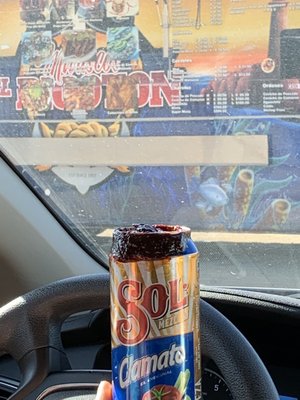
This screenshot has width=300, height=400. I want to click on window, so click(x=279, y=234).